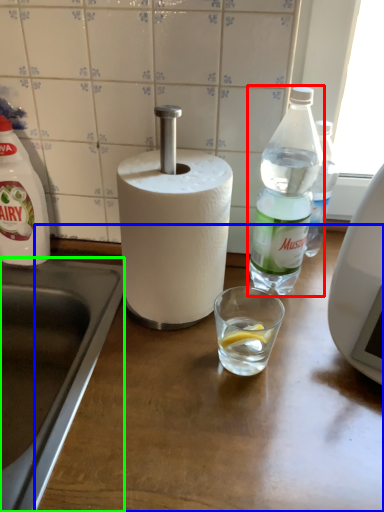
Question: Which is nearer to the bottle (highlighted by a red box)? counter top (highlighted by a blue box) or sink (highlighted by a green box).

Choices:
 (A) counter top
 (B) sink

Answer: (A)